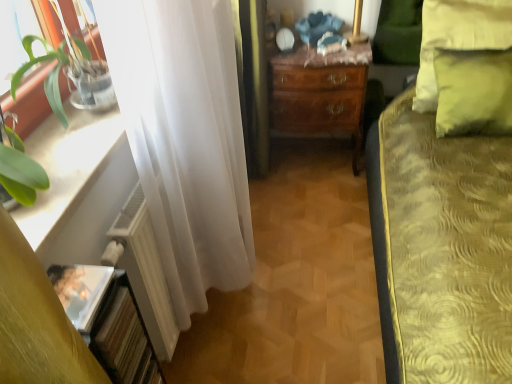
Image resolution: width=512 pixels, height=384 pixels. Identify the location of free location in front of mahogany wooden desk at center. (318, 200).